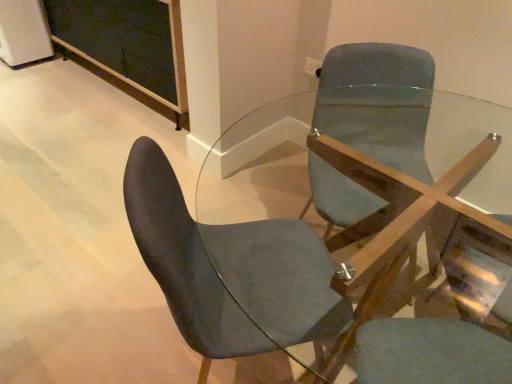
Describe the element at coordinates (215, 259) in the screenshot. I see `velvet dark blue chair at center` at that location.

This screenshot has height=384, width=512. What are the coordinates of `matte blue swivel chair at center` in the screenshot? It's located at (450, 324).

The width and height of the screenshot is (512, 384). Identify the location of clear glass table at center. (355, 222).

Which of these two, matte blue swivel chair at center or clear glass table at center, is smaller?

With smaller size is matte blue swivel chair at center.

Is matte blue swivel chair at center positioned with its back to clear glass table at center?

That's right, matte blue swivel chair at center is facing away from clear glass table at center.

Which object is closer to the camera, clear glass table at center or matte blue swivel chair at center?

matte blue swivel chair at center is in front.

In the scene shown: Is the surface of clear glass table at center in direct contact with matte blue swivel chair at center?

clear glass table at center and matte blue swivel chair at center are clearly separated.

Can you tell me how much clear glass table at center and matte blue swivel chair at center differ in facing direction?

The facing directions of clear glass table at center and matte blue swivel chair at center are 141 degrees apart.

Which object is closer to the camera taking this photo, clear glass table at center or velvet dark blue chair at center?

Positioned in front is clear glass table at center.

Considering the sizes of clear glass table at center and velvet dark blue chair at center in the image, is clear glass table at center taller or shorter than velvet dark blue chair at center?

Considering their sizes, clear glass table at center has less height than velvet dark blue chair at center.

Considering the sizes of objects clear glass table at center and velvet dark blue chair at center in the image provided, who is bigger, clear glass table at center or velvet dark blue chair at center?

clear glass table at center is bigger.

This screenshot has height=384, width=512. There is a clear glass table at center. In order to click on chair above it (from a real-world perspective) in this screenshot , I will do `click(215, 259)`.

Does point (301, 227) appear closer or farther from the camera than point (501, 109)?

Clearly, point (301, 227) is closer to the camera than point (501, 109).

Is velvet dark blue chair at center further to camera compared to clear glass table at center?

Yes, velvet dark blue chair at center is further from the camera.

From the image's perspective, is velvet dark blue chair at center positioned above or below clear glass table at center?

Based on their image positions, velvet dark blue chair at center is located above clear glass table at center.

Is clear glass table at center at the back of velvet dark blue chair at center?

Correct, velvet dark blue chair at center is looking away from clear glass table at center.

Is matte blue swivel chair at center oriented towards velvet dark blue chair at center?

No, matte blue swivel chair at center does not turn towards velvet dark blue chair at center.

Which point is more distant from viewer, (480, 298) or (146, 230)?

The point (480, 298) is farther.

Is matte blue swivel chair at center not close to velvet dark blue chair at center?

Actually, matte blue swivel chair at center and velvet dark blue chair at center are a little close together.

Is velvet dark blue chair at center next to matte blue swivel chair at center and touching it?

They are not placed beside each other.

From the image's perspective, which is above, velvet dark blue chair at center or matte blue swivel chair at center?

From the image's view, velvet dark blue chair at center is above.

Between point (254, 335) and point (475, 328), which one is positioned behind?

The point (475, 328) is farther from the camera.

Considering the relative positions of velvet dark blue chair at center and matte blue swivel chair at center in the image provided, is velvet dark blue chair at center behind matte blue swivel chair at center?

Result: Yes, velvet dark blue chair at center is further from the camera.

At what (x,y) coordinates should I click in order to perform the action: click on swivel chair above the clear glass table at center (from a real-world perspective). Please return your answer as a coordinate pair (x, y). This screenshot has width=512, height=384. Looking at the image, I should click on (450, 324).

Find the location of a particular element. swivel chair located below the clear glass table at center (from the image's perspective) is located at coordinates (450, 324).

Considering their positions, is clear glass table at center positioned further to matte blue swivel chair at center than velvet dark blue chair at center?

The object further to matte blue swivel chair at center is velvet dark blue chair at center.

Looking at the image, which one is located further to clear glass table at center, velvet dark blue chair at center or matte blue swivel chair at center?

Based on the image, velvet dark blue chair at center appears to be further to clear glass table at center.

When comparing their distances from velvet dark blue chair at center, does matte blue swivel chair at center or clear glass table at center seem further?

Among the two, matte blue swivel chair at center is located further to velvet dark blue chair at center.

Which object lies further to the anchor point clear glass table at center, matte blue swivel chair at center or velvet dark blue chair at center?

velvet dark blue chair at center is positioned further to the anchor clear glass table at center.

Considering their positions, is velvet dark blue chair at center positioned closer to matte blue swivel chair at center than clear glass table at center?

clear glass table at center lies closer to matte blue swivel chair at center than the other object.

Which object lies further to the anchor point velvet dark blue chair at center, clear glass table at center or matte blue swivel chair at center?

The object further to velvet dark blue chair at center is matte blue swivel chair at center.

This screenshot has height=384, width=512. Identify the location of table between velvet dark blue chair at center and matte blue swivel chair at center from left to right. (355, 222).